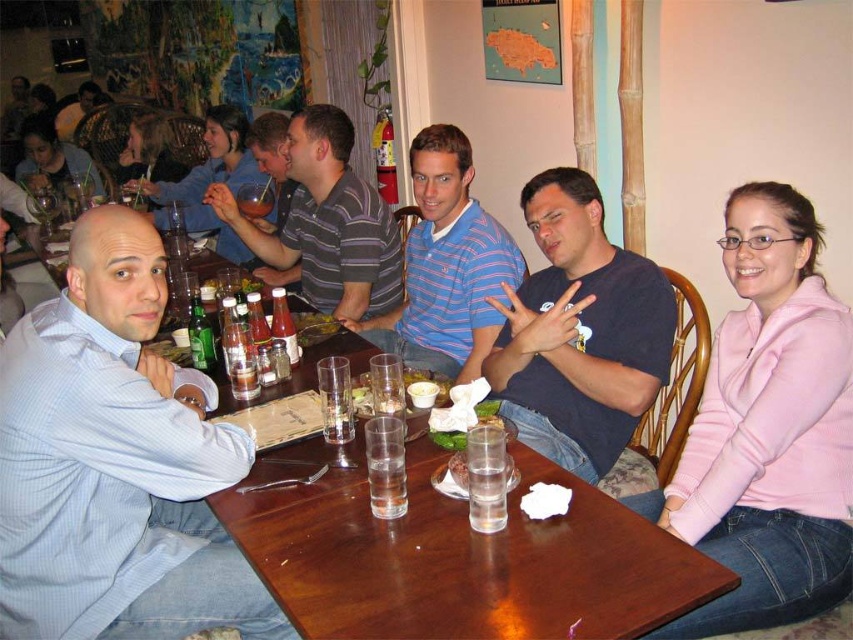
Between matte black shirt at upper left and matte black shirt at center, which one appears on the right side from the viewer's perspective?

Positioned to the right is matte black shirt at center.

Measure the distance between matte black shirt at upper left and camera.

A distance of 11.27 feet exists between matte black shirt at upper left and camera.

Is point (196, 193) behind point (252, 145)?

That is True.

In order to click on matte black shirt at upper left in this screenshot , I will do `click(210, 180)`.

Can you confirm if light blue checkered shirt at left is positioned above matte black shirt at center?

Incorrect, light blue checkered shirt at left is not positioned above matte black shirt at center.

Does point (166, 461) come farther from viewer compared to point (264, 148)?

No, (166, 461) is in front of (264, 148).

This screenshot has width=853, height=640. Identify the location of light blue checkered shirt at left. pos(115,464).

Does wooden table at center appear over matte black shirt at upper left?

No.

Consider the image. Who is lower down, wooden table at center or matte black shirt at upper left?

wooden table at center is lower down.

Is point (134, 561) behind point (200, 221)?

No, it is not.

Identify the location of wooden table at center. (122, 467).